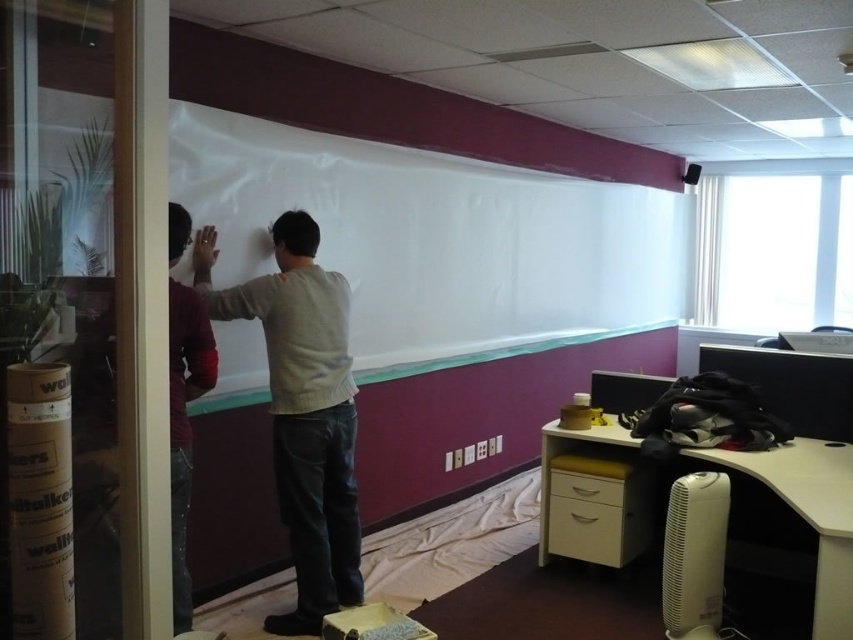
Question: Which object is closer to the camera taking this photo?

Choices:
 (A) light gray sweater at center
 (B) white matte board at center

Answer: (A)

Question: Can you confirm if white matte board at center is bigger than light gray sweater at center?

Choices:
 (A) no
 (B) yes

Answer: (B)

Question: Based on their relative distances, which object is farther from the maroon sweater at left?

Choices:
 (A) white matte board at center
 (B) light gray sweater at center

Answer: (A)

Question: Does light gray sweater at center appear on the left side of maroon sweater at left?

Choices:
 (A) no
 (B) yes

Answer: (A)

Question: Which of the following is the closest to the observer?

Choices:
 (A) maroon sweater at left
 (B) white matte board at center

Answer: (A)

Question: In this image, where is white matte board at center located relative to light gray sweater at center?

Choices:
 (A) above
 (B) below

Answer: (A)